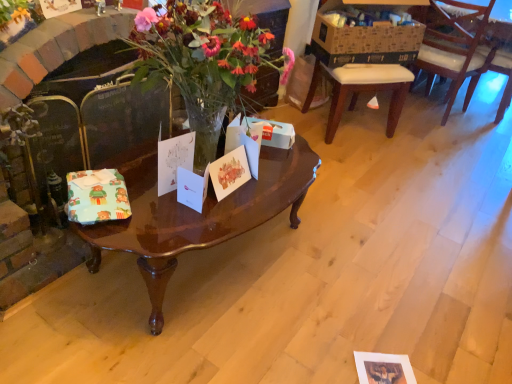
Where is `brightly colored paper at center, which is the 1th gift card in left-to-right order`? This screenshot has width=512, height=384. brightly colored paper at center, which is the 1th gift card in left-to-right order is located at coordinates pyautogui.click(x=97, y=196).

The width and height of the screenshot is (512, 384). I want to click on white paper gift card at center, arranged as the third gift card when viewed from the right, so click(x=174, y=160).

Locate an element on the screen. The width and height of the screenshot is (512, 384). white paper gift card at center, arranged as the third gift card when viewed from the left is located at coordinates (192, 188).

Image resolution: width=512 pixels, height=384 pixels. I want to click on wooden chair at right, so click(366, 36).

The image size is (512, 384). Describe the element at coordinates (198, 217) in the screenshot. I see `glossy wood coffee table at center` at that location.

What is the approximate width of brown cardboard box at upper right?

The width of brown cardboard box at upper right is 28.98 centimeters.

The image size is (512, 384). Describe the element at coordinates (364, 35) in the screenshot. I see `brown cardboard box at upper right` at that location.

The width and height of the screenshot is (512, 384). I want to click on brightly colored paper at center, positioned as the fourth gift card in right-to-left order, so click(x=97, y=196).

From a real-world perspective, which object stands above the other?

white paper gift card at center, acting as the second gift card starting from the left, from a real-world perspective.

Which is in front, glossy wood coffee table at center or white paper gift card at center, arranged as the third gift card when viewed from the right?

glossy wood coffee table at center is more forward.

From the image's perspective, is glossy wood coffee table at center beneath white paper gift card at center, acting as the second gift card starting from the left?

Indeed, from the image's perspective, glossy wood coffee table at center is shown beneath white paper gift card at center, acting as the second gift card starting from the left.

Is glossy wood coffee table at center surrounding white paper gift card at center, arranged as the third gift card when viewed from the right?

That's incorrect, white paper gift card at center, arranged as the third gift card when viewed from the right, is not inside glossy wood coffee table at center.

The width and height of the screenshot is (512, 384). Identify the location of coffee table below the brown cardboard box at upper right (from a real-world perspective). (198, 217).

From a real-world perspective, which is physically below, brown cardboard box at upper right or glossy wood coffee table at center?

In real-world perspective, glossy wood coffee table at center is lower.

How distant is brown cardboard box at upper right from glossy wood coffee table at center?

The distance of brown cardboard box at upper right from glossy wood coffee table at center is 4.67 feet.

Could glossy wood coffee table at center be considered to be inside brown cardboard box at upper right?

No.

Can we say white paper gift card at center, the first gift card from the right, lies outside glossy wood coffee table at center?

Yes, white paper gift card at center, the first gift card from the right, is not within glossy wood coffee table at center.

Does white paper gift card at center, the fourth gift card viewed from the left, have a lesser height compared to glossy wood coffee table at center?

Yes.

From the picture: From the image's perspective, is white paper gift card at center, the first gift card from the right, located beneath glossy wood coffee table at center?

No.

Is brightly colored paper at center, which is the 1th gift card in left-to-right order, spatially inside white paper gift card at center, acting as the second gift card starting from the left, or outside of it?

The correct answer is: outside.

From a real-world perspective, between brightly colored paper at center, which is the 1th gift card in left-to-right order, and white paper gift card at center, acting as the second gift card starting from the left, who is vertically higher?

In real-world perspective, white paper gift card at center, acting as the second gift card starting from the left, is above.

Based on the photo, does brightly colored paper at center, which is the 1th gift card in left-to-right order, have a lesser width compared to white paper gift card at center, arranged as the third gift card when viewed from the right?

No.

Who is taller, brightly colored paper at center, which is the 1th gift card in left-to-right order, or white paper gift card at center, arranged as the third gift card when viewed from the right?

white paper gift card at center, arranged as the third gift card when viewed from the right, is taller.

From a real-world perspective, which object stands above the other?

From a 3D spatial view, white paper gift card at center, which is counted as the 2th gift card, starting from the right, is above.

Is white paper gift card at center, which is counted as the 2th gift card, starting from the right, in front of or behind wooden chair at right in the image?

Visually, white paper gift card at center, which is counted as the 2th gift card, starting from the right, is located in front of wooden chair at right.

Considering the relative sizes of white paper gift card at center, which is counted as the 2th gift card, starting from the right, and wooden chair at right in the image provided, is white paper gift card at center, which is counted as the 2th gift card, starting from the right, shorter than wooden chair at right?

Indeed, white paper gift card at center, which is counted as the 2th gift card, starting from the right, has a lesser height compared to wooden chair at right.

What's the angular difference between white paper gift card at center, which is counted as the 2th gift card, starting from the right, and wooden chair at right's facing directions?

There is a 50.7-degree angle between the facing directions of white paper gift card at center, which is counted as the 2th gift card, starting from the right, and wooden chair at right.

Which is behind, point (188, 182) or point (415, 32)?

Positioned behind is point (415, 32).

From a real-world perspective, who is located lower, white paper gift card at center, arranged as the third gift card when viewed from the left, or wooden chair at right?

From a 3D spatial view, white paper gift card at center, arranged as the third gift card when viewed from the left, is below.

Considering the relative sizes of white paper gift card at center, which is counted as the 2th gift card, starting from the right, and wooden chair at right in the image provided, is white paper gift card at center, which is counted as the 2th gift card, starting from the right, taller than wooden chair at right?

In fact, white paper gift card at center, which is counted as the 2th gift card, starting from the right, may be shorter than wooden chair at right.

From a real-world perspective, is wooden chair at right positioned over white paper gift card at center, acting as the second gift card starting from the left, based on gravity?

No, from a real-world perspective, wooden chair at right is not over white paper gift card at center, acting as the second gift card starting from the left

From the picture: Between wooden chair at right and white paper gift card at center, acting as the second gift card starting from the left, which one has more height?

wooden chair at right is taller.

Is wooden chair at right smaller than white paper gift card at center, acting as the second gift card starting from the left?

Actually, wooden chair at right might be larger than white paper gift card at center, acting as the second gift card starting from the left.

Find the location of a particular element. The height and width of the screenshot is (384, 512). coffee table to the right of white paper gift card at center, arranged as the third gift card when viewed from the right is located at coordinates (198, 217).

Identify the location of coffee table to the left of brown cardboard box at upper right. This screenshot has width=512, height=384. [x=198, y=217].

Estimate the real-world distances between objects in this image. Which object is closer to brightly colored paper at center, which is the 1th gift card in left-to-right order, white paper gift card at center, the first gift card from the right, or white paper gift card at center, acting as the second gift card starting from the left?

white paper gift card at center, acting as the second gift card starting from the left, is positioned closer to the anchor brightly colored paper at center, which is the 1th gift card in left-to-right order.

Considering their positions, is brightly colored paper at center, which is the 1th gift card in left-to-right order, positioned further to white paper gift card at center, the first gift card from the right, than glossy wood coffee table at center?

Among the two, brightly colored paper at center, which is the 1th gift card in left-to-right order, is located further to white paper gift card at center, the first gift card from the right.

Looking at the image, which one is located further to brown cardboard box at upper right, wooden chair at right or glossy wood coffee table at center?

Among the two, glossy wood coffee table at center is located further to brown cardboard box at upper right.

Based on their spatial positions, is white paper gift card at center, acting as the second gift card starting from the left, or white paper gift card at center, arranged as the third gift card when viewed from the left, further from white paper gift card at center, the first gift card from the right?

Based on the image, white paper gift card at center, acting as the second gift card starting from the left, appears to be further to white paper gift card at center, the first gift card from the right.

Estimate the real-world distances between objects in this image. Which object is closer to white paper gift card at center, acting as the second gift card starting from the left, glossy wood coffee table at center or white paper gift card at center, the fourth gift card viewed from the left?

Based on the image, white paper gift card at center, the fourth gift card viewed from the left, appears to be nearer to white paper gift card at center, acting as the second gift card starting from the left.

Based on their spatial positions, is wooden chair at right or brown cardboard box at upper right closer to brightly colored paper at center, which is the 1th gift card in left-to-right order?

The object closer to brightly colored paper at center, which is the 1th gift card in left-to-right order, is brown cardboard box at upper right.

Which object lies further to the anchor point wooden chair at right, brown cardboard box at upper right or white paper gift card at center, arranged as the third gift card when viewed from the right?

Based on the image, white paper gift card at center, arranged as the third gift card when viewed from the right, appears to be further to wooden chair at right.

Looking at the image, which one is located closer to white paper gift card at center, acting as the second gift card starting from the left, brightly colored paper at center, which is the 1th gift card in left-to-right order, or glossy wood coffee table at center?

Based on the image, brightly colored paper at center, which is the 1th gift card in left-to-right order, appears to be nearer to white paper gift card at center, acting as the second gift card starting from the left.

You are a GUI agent. You are given a task and a screenshot of the screen. Output one action in this format:
    pyautogui.click(x=<x>, y=<y>)
    Task: Click on the desk positioned between white paper gift card at center, the first gift card from the right, and brown cardboard box at upper right from near to far
    
    Given the screenshot: What is the action you would take?
    pyautogui.click(x=366, y=36)

At what (x,y) coordinates should I click in order to perform the action: click on gift card between white paper gift card at center, acting as the second gift card starting from the left, and white paper gift card at center, the first gift card from the right, from left to right. Please return your answer as a coordinate pair (x, y). Image resolution: width=512 pixels, height=384 pixels. Looking at the image, I should click on point(192,188).

The image size is (512, 384). Find the location of `desk located between brightly colored paper at center, positioned as the fourth gift card in right-to-left order, and wooden chair at right in the left-right direction`. desk located between brightly colored paper at center, positioned as the fourth gift card in right-to-left order, and wooden chair at right in the left-right direction is located at coordinates point(366,36).

The height and width of the screenshot is (384, 512). What are the coordinates of `box between white paper gift card at center, acting as the second gift card starting from the left, and wooden chair at right from left to right` in the screenshot? It's located at (364, 35).